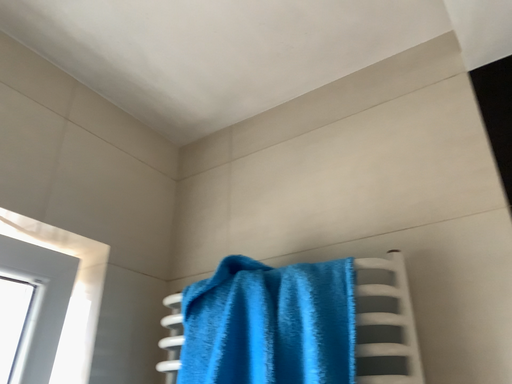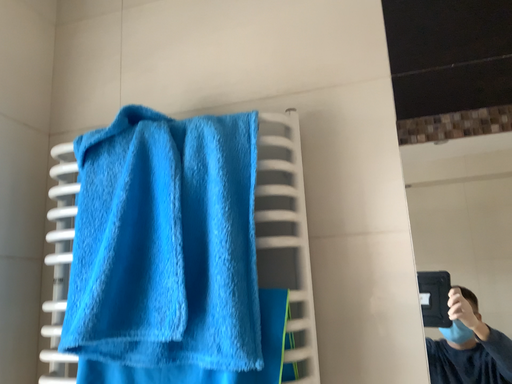
Question: Which way did the camera rotate in the video?

Choices:
 (A) rotated right
 (B) rotated left

Answer: (A)